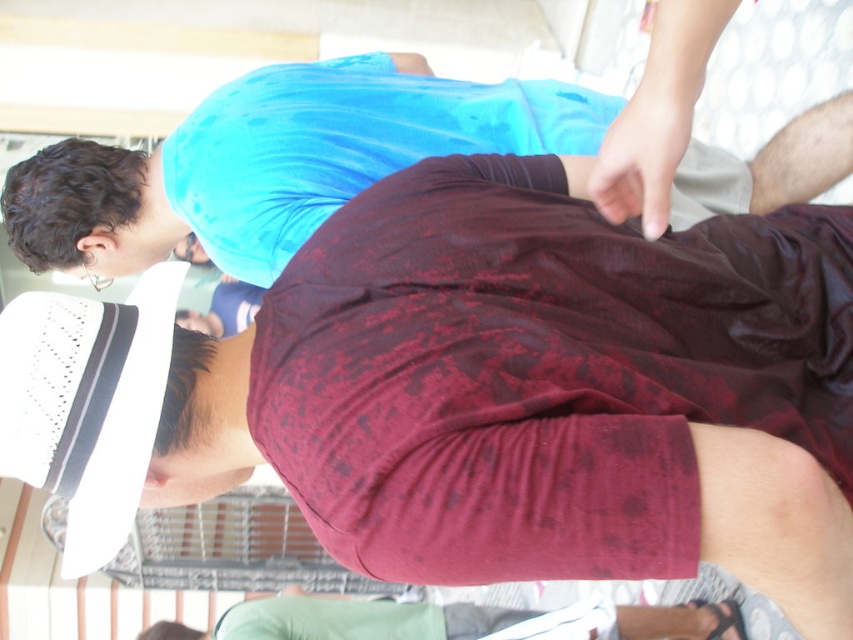
You are standing at the position of point (265,627) and want to throw a ball to point (341,131). Considering the spatial arrangement in the scene, will the ball pass in front of or behind the person in the maroon shirt?

The ball will pass in front of the person in the maroon shirt because point (341,131) is in front of point (265,627).

You are at an event and need to reach the matte blue shirt at upper center without stepping over the maroon fabric shirt at lower center. Is the path between them wide enough for you to walk through?

The maroon fabric shirt at lower center is not as tall as matte blue shirt at upper center, so the path between them is likely wide enough for you to walk through without stepping over the maroon fabric shirt at lower center.

You are organizing a photo shoot and need to ensure that the two maroon shirts in the image are at least 2 meters apart for proper lighting. Based on the scene, can you confirm if the distance between the maroon textured shirt at upper center and the maroon fabric shirt at lower center meets this requirement?

The maroon textured shirt at upper center is 2.31 meters from maroon fabric shirt at lower center, which exceeds the 2 meters requirement. Therefore, the distance between the maroon textured shirt at upper center and the maroon fabric shirt at lower center meets the requirement.